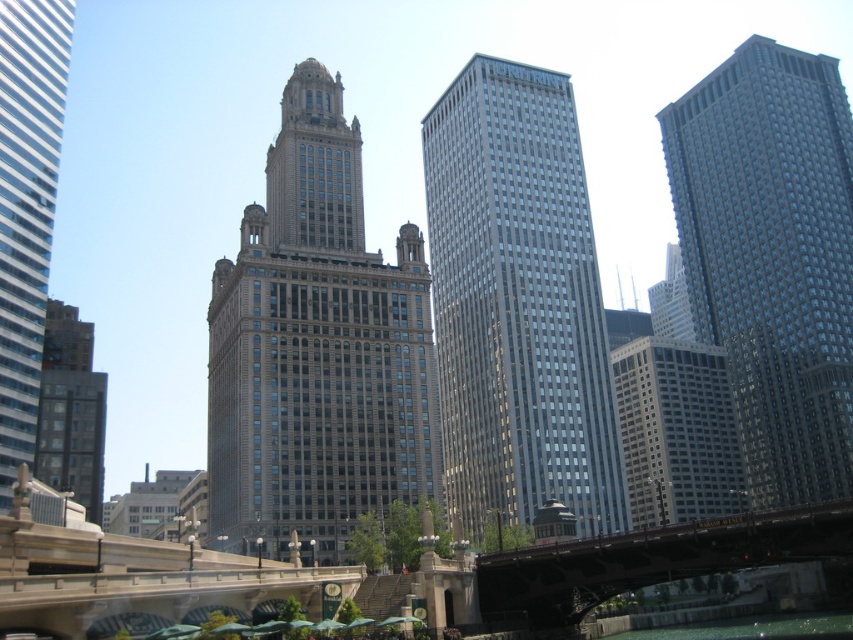
You are standing on the sidewalk near the beige stone tower at center and want to cross the street to reach the metallic gray bridge at lower center. Which direction should you walk to get to the bridge?

Since the beige stone tower at center is closer to you than the metallic gray bridge at lower center, you should walk away from the beige stone tower at center towards the metallic gray bridge at lower center to reach the bridge.

You are standing on the bridge and want to walk towards the historic building. Which direction should you go relative to the glassy steel skyscraper at center and the glassy steel skyscraper at right?

You should walk towards the glassy steel skyscraper at center, as it is to the left of the glassy steel skyscraper at right, and the bridge leads towards the historic building in the center.

You are a city planner evaluating the urban layout. Considering the presence of the matte glass skyscraper at left and the metallic gray bridge at lower center, which structure would require more space for construction? Please explain your reasoning based on their sizes.

The matte glass skyscraper at left requires more space for construction because it has a larger size compared to the metallic gray bridge at lower center.